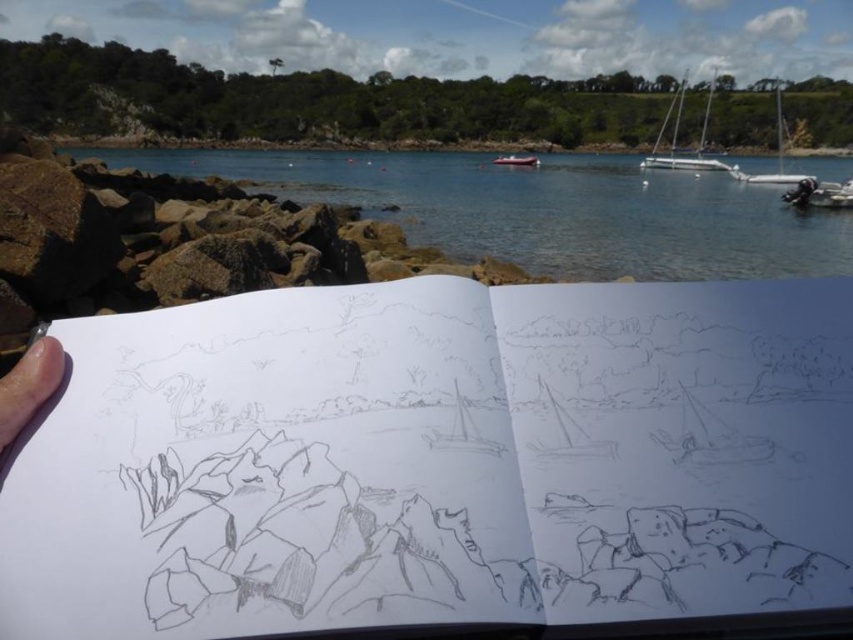
You are an artist holding a sketchbook and observing the coastal scene. You notice a point marked at coordinates (28, 387). Based on the scene description, where is this point located relative to the sketchbook?

The point marked at coordinates (28, 387) is located at the lower left of the sketchbook, where the skin or hand is holding it.